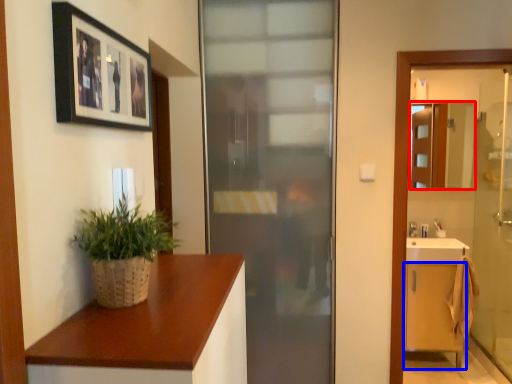
Question: Among these objects, which one is nearest to the camera, mirror (highlighted by a red box) or cabinetry (highlighted by a blue box)?

Choices:
 (A) mirror
 (B) cabinetry

Answer: (B)